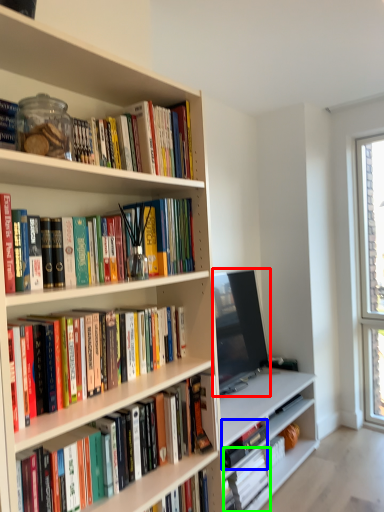
Question: Which is farther away from television (highlighted by a red box)? book (highlighted by a blue box) or book (highlighted by a green box)?

Choices:
 (A) book
 (B) book

Answer: (B)